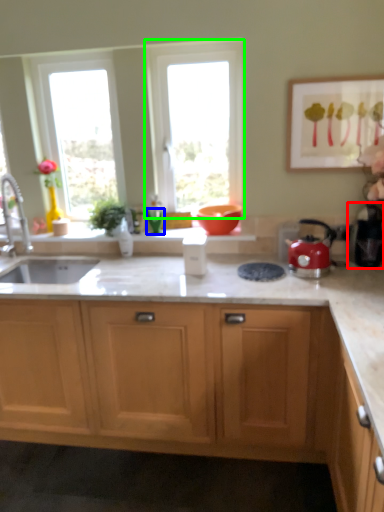
Question: Considering the real-world distances, which object is farthest from coffee machine (highlighted by a red box)? glass vase (highlighted by a blue box) or window (highlighted by a green box)?

Choices:
 (A) glass vase
 (B) window

Answer: (A)